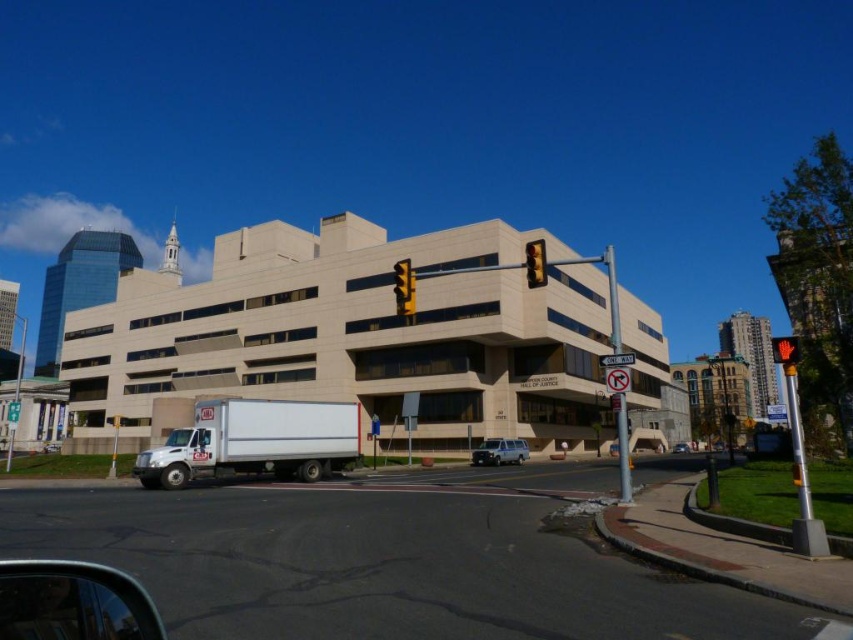
Question: Does white matte truck at lower left have a lesser width compared to yellow matte traffic light at upper center?

Choices:
 (A) yes
 (B) no

Answer: (B)

Question: Among these points, which one is farthest from the camera?

Choices:
 (A) (790, 340)
 (B) (412, 289)
 (C) (526, 257)
 (D) (486, 456)

Answer: (D)

Question: Considering the relative positions of silver metallic van at center and yellow matte traffic light at upper center in the image provided, where is silver metallic van at center located with respect to yellow matte traffic light at upper center?

Choices:
 (A) above
 (B) below

Answer: (B)

Question: Can you confirm if silver metallic van at center is positioned to the right of yellow matte traffic light at upper center?

Choices:
 (A) no
 (B) yes

Answer: (B)

Question: Which object appears farthest from the camera in this image?

Choices:
 (A) metallic yellow traffic light at upper center
 (B) yellow matte traffic light at upper center
 (C) silver metallic van at center

Answer: (C)

Question: Which point is closer to the camera taking this photo?

Choices:
 (A) (492, 460)
 (B) (405, 289)

Answer: (B)